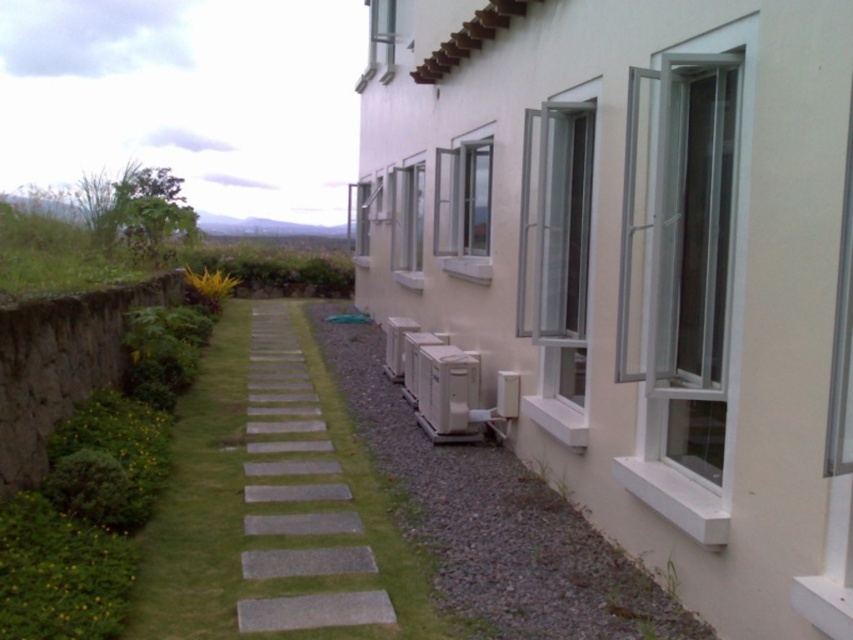
You are a gardener who needs to water the green grass at lower left and the gray concrete path at center. Which one is closer to the stone wall?

Answer: The gray concrete path at center is closer to the stone wall because the green grass at lower left is located below it, meaning the path is between the grass and the wall.

You are a gardener planning to mow the green grass at lower left and the gray concrete path at center. Which area requires more time to mow?

The gray concrete path at center requires more time to mow because it occupies more space than the green grass at lower left.

You are standing at the entrance of the building and want to walk to the garden on the left side. Which direction should you turn to reach the green grass at lower left from the gray concrete path at center?

You should turn to the left to reach the green grass at lower left from the gray concrete path at center because the green grass at lower left is located to the right of the gray concrete path at center, meaning it is positioned on the left side of the path when facing away from the building.